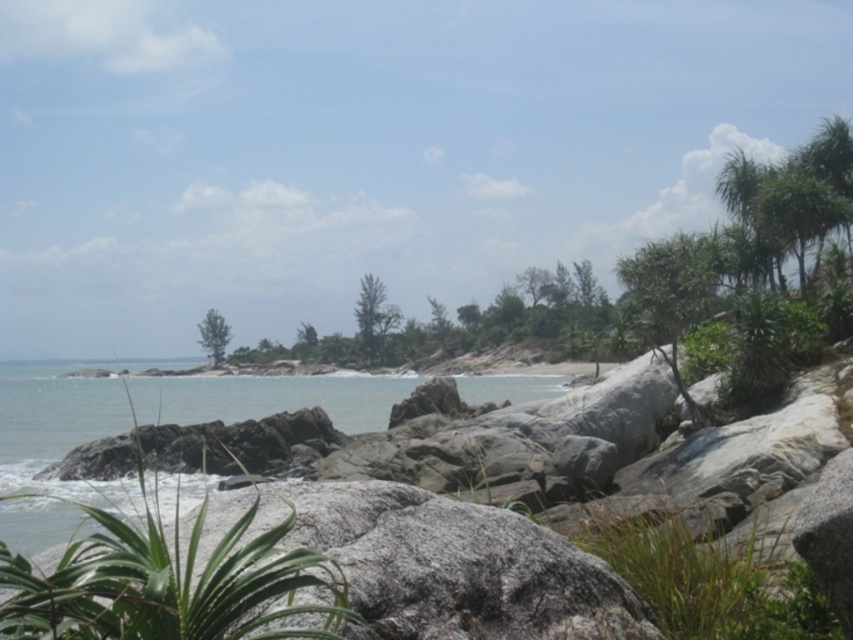
You are standing on the rocky shoreline and want to walk to the green leafy tree at center. Which direction should you go to avoid the clear water at center?

You should walk around the clear water at center towards the right or left side since the clear water at center is closer to you than the green leafy tree at center, which is further back.

You are standing on the rocky shoreline and want to reach the green leafy palm tree at upper right. Which direction should you walk to avoid the clear water at center?

You should walk to the right to avoid the clear water at center, as it is located to the left of the green leafy palm tree at upper right.

You are standing at the rocky shoreline in the foreground of the coastal landscape. You see two points marked in the image. The first point is located at coordinates point (65, 502) and the second at point (218, 336). Which of these two points is closer to you?

Point (65, 502) is in front of point (218, 336), so it is closer to you.